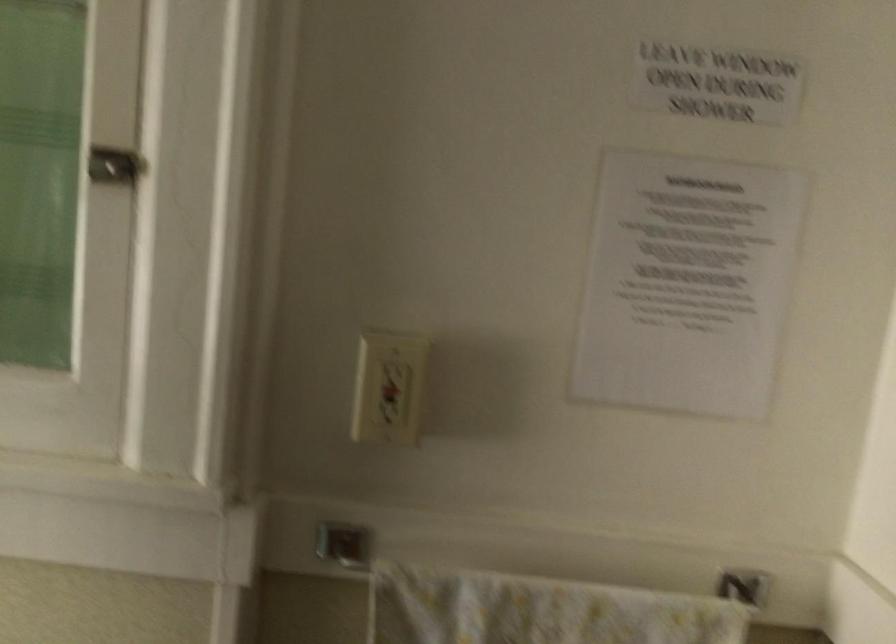
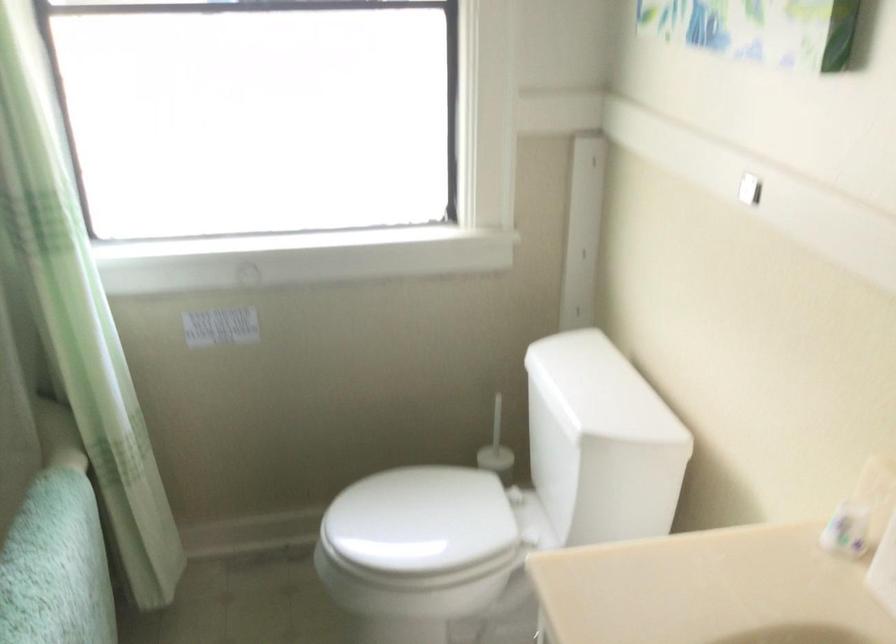
The images are taken continuously from a first-person perspective. In which direction is your viewpoint rotating?

The camera's rotation is toward left-down.